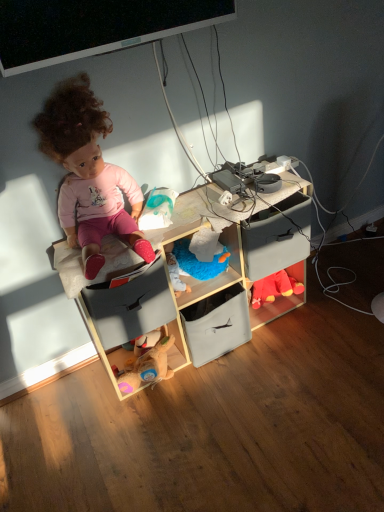
The image size is (384, 512). I want to click on blank space situated above soft fabric storage at center, positioned as the second shelf in left-to-right order (from a real-world perspective), so [210, 296].